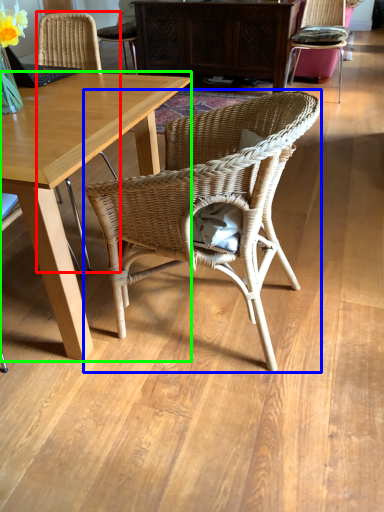
Question: Which object is the farthest from chair (highlighted by a red box)? Choose among these: chair (highlighted by a blue box) or desk (highlighted by a green box).

Choices:
 (A) chair
 (B) desk

Answer: (A)